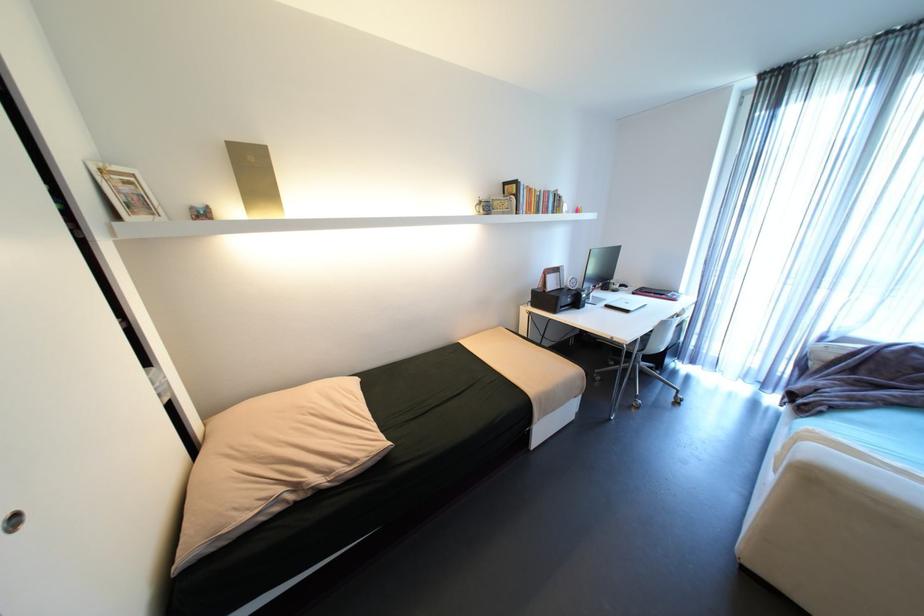
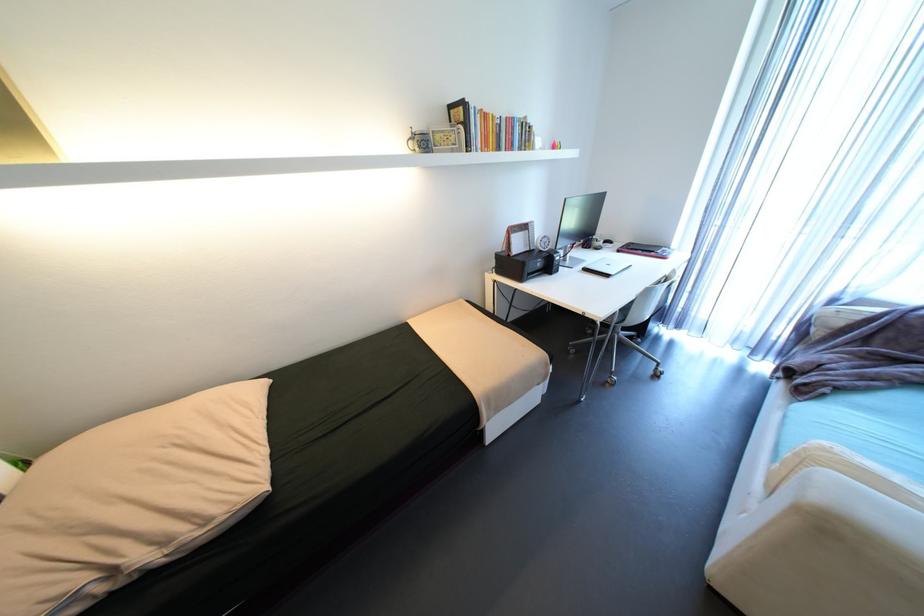
Question: The images are taken continuously from a first-person perspective. In which direction is your viewpoint rotating?

Choices:
 (A) Left
 (B) Right
 (C) Up
 (D) Down

Answer: (D)